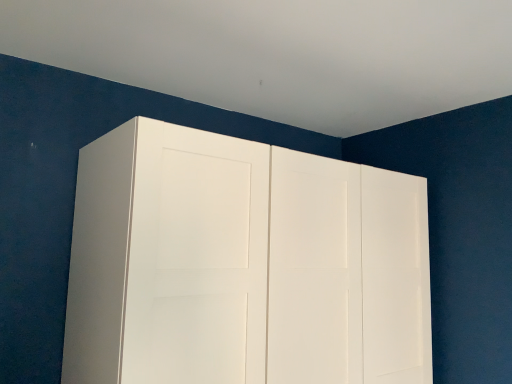
The width and height of the screenshot is (512, 384). Describe the element at coordinates (243, 264) in the screenshot. I see `white matte cabinet at center` at that location.

Image resolution: width=512 pixels, height=384 pixels. I want to click on white matte cabinet at center, so click(x=243, y=264).

Locate an element on the screen. white matte cabinet at center is located at coordinates (243, 264).